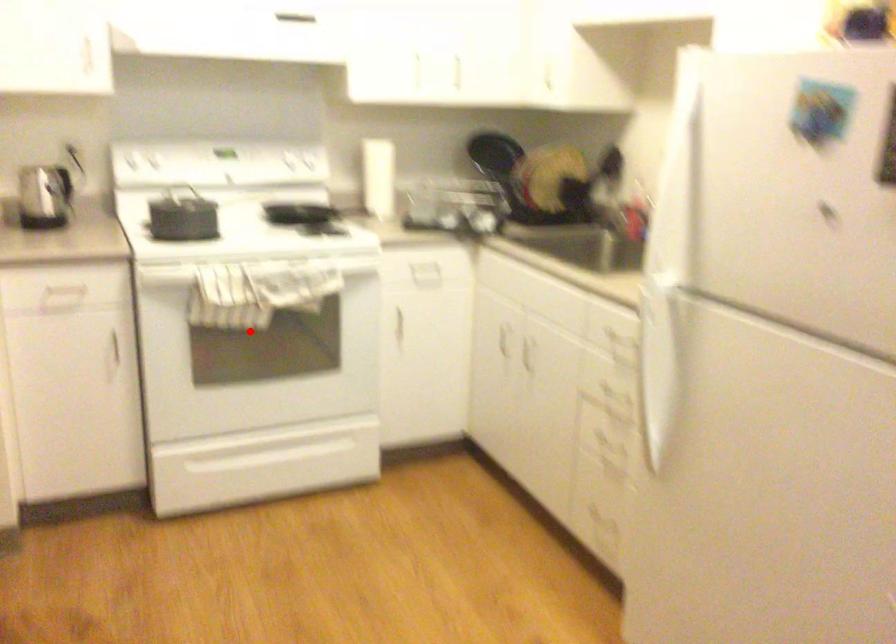
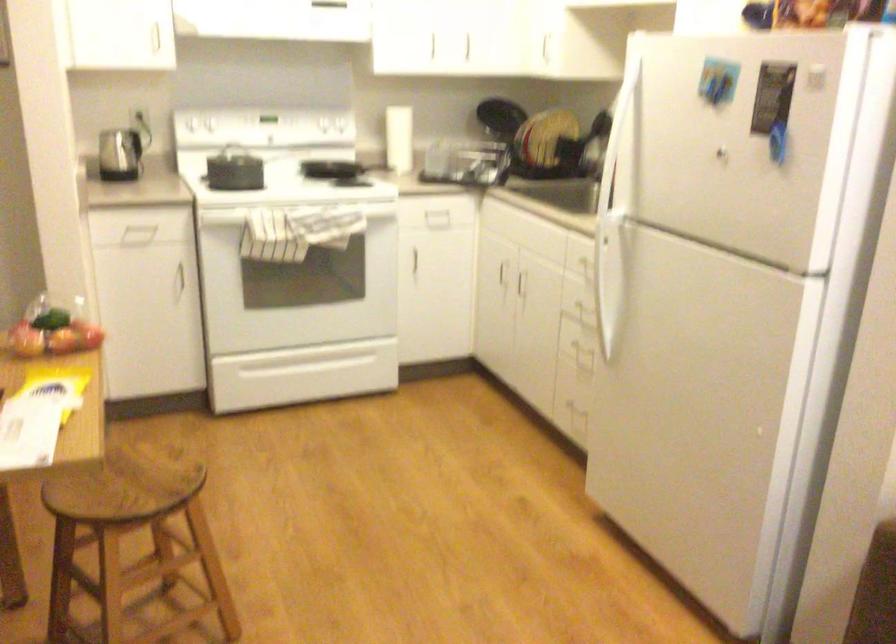
In the second image, find the point that corresponds to the highlighted location in the first image.

(289, 261)